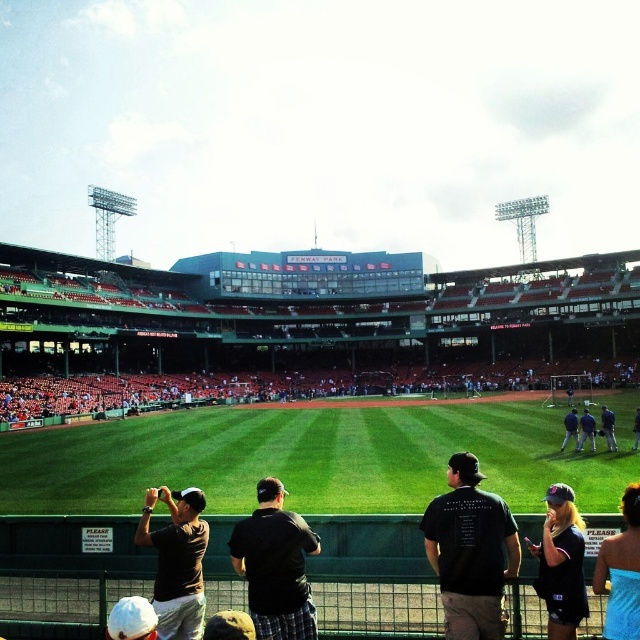
Consider the image. Who is shorter, black matte t-shirt at center or dark blue shirt at center?

Standing shorter between the two is dark blue shirt at center.

At what (x,y) coordinates should I click in order to perform the action: click on black matte t-shirt at center. Please return your answer as a coordinate pair (x, y). The image size is (640, 640). Looking at the image, I should click on (468, 552).

Does black matte t-shirt at center have a lesser width compared to dark blue jacket at right?

Yes.

Who is more forward, (474, 506) or (570, 433)?

Point (474, 506) is more forward.

What do you see at coordinates (468, 552) in the screenshot?
I see `black matte t-shirt at center` at bounding box center [468, 552].

The width and height of the screenshot is (640, 640). What are the coordinates of `black matte t-shirt at center` in the screenshot? It's located at (468, 552).

Is matte black shirt at lower left thinner than matte black baseball cap at lower right?

In fact, matte black shirt at lower left might be wider than matte black baseball cap at lower right.

Locate an element on the screen. matte black shirt at lower left is located at coordinates (177, 561).

In order to click on matte black shirt at lower left in this screenshot , I will do `click(177, 561)`.